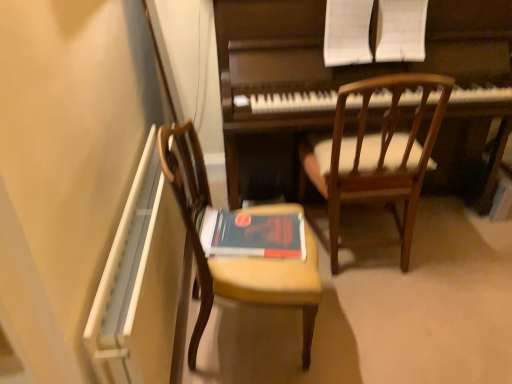
Where is `free location in front of wooden chair at upper right, the 1th chair from the right`? The height and width of the screenshot is (384, 512). free location in front of wooden chair at upper right, the 1th chair from the right is located at coordinates (401, 319).